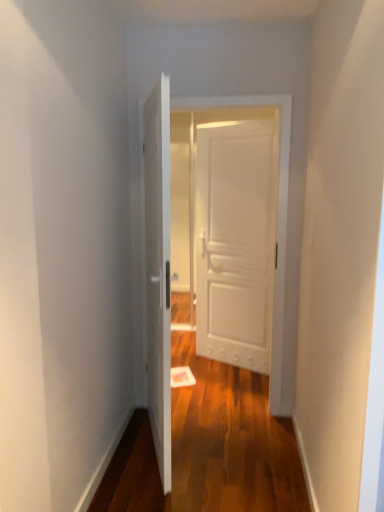
Identify the location of free area below white matte door at center, which is the third door from front to back (from a real-world perspective). (230, 364).